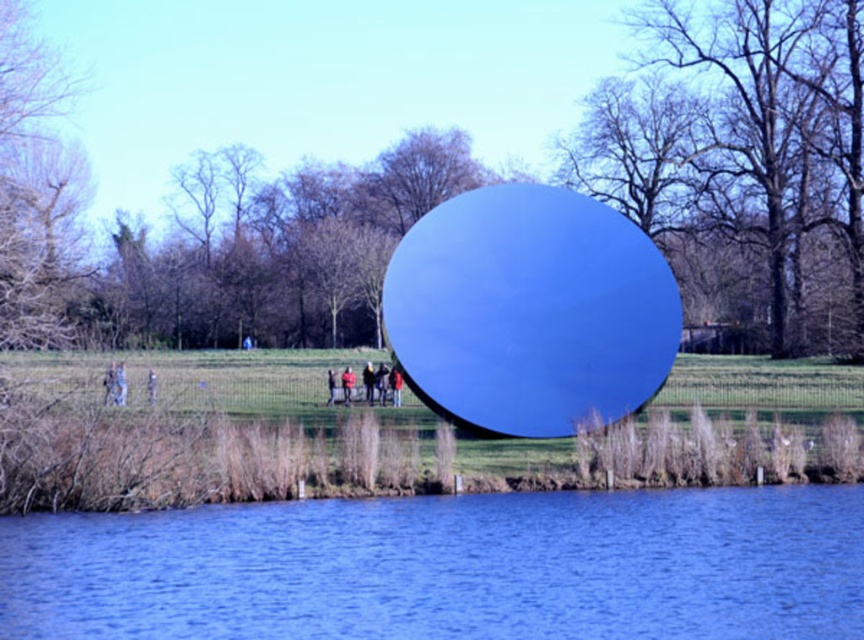
Question: Which of the following is the farthest from the observer?

Choices:
 (A) blue liquid at center
 (B) red jacket at center

Answer: (B)

Question: Is blue liquid at center above red jacket at center?

Choices:
 (A) no
 (B) yes

Answer: (A)

Question: Among these objects, which one is nearest to the camera?

Choices:
 (A) blue liquid at center
 (B) red jacket at center

Answer: (A)

Question: Can you confirm if blue liquid at center is bigger than red jacket at center?

Choices:
 (A) no
 (B) yes

Answer: (B)

Question: Can you confirm if blue liquid at center is positioned above red jacket at center?

Choices:
 (A) no
 (B) yes

Answer: (A)